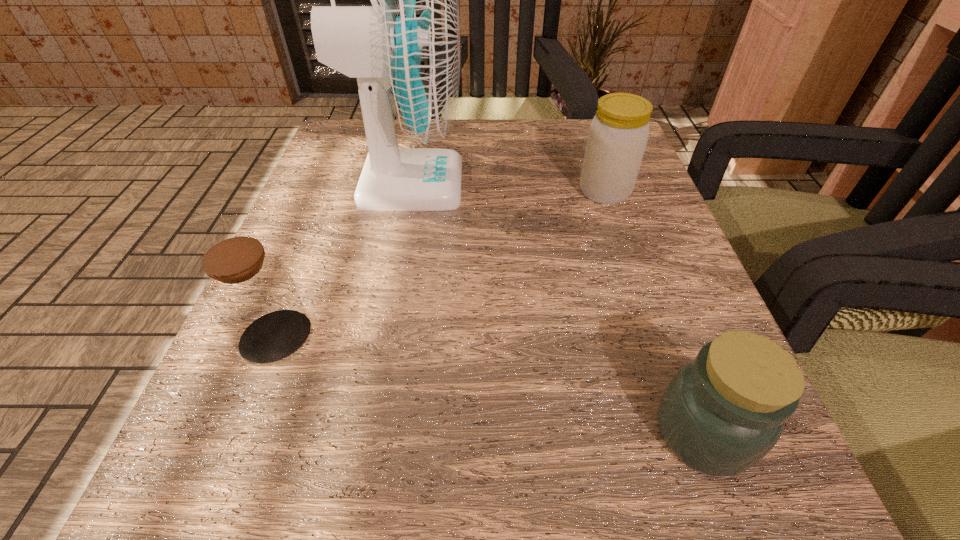
Locate an element on the screen. vacant space that's between the third farthest object and the nearest object is located at coordinates (490, 384).

Image resolution: width=960 pixels, height=540 pixels. I want to click on empty location between the leftmost jar and the nearest object, so (490, 384).

You are a GUI agent. You are given a task and a screenshot of the screen. Output one action in this format:
    pyautogui.click(x=<x>, y=<y>)
    Task: Click on the unoccupied area between the second farthest jar and the nearest object
    This screenshot has height=540, width=960.
    Given the screenshot: What is the action you would take?
    pyautogui.click(x=490, y=384)

The width and height of the screenshot is (960, 540). What are the coordinates of `vacant point located between the farthest jar and the leftmost jar` in the screenshot? It's located at (441, 264).

At what (x,y) coordinates should I click in order to perform the action: click on object that stands as the third closest to the farthest jar. Please return your answer as a coordinate pair (x, y). The height and width of the screenshot is (540, 960). Looking at the image, I should click on (251, 293).

You are a GUI agent. You are given a task and a screenshot of the screen. Output one action in this format:
    pyautogui.click(x=<x>, y=<y>)
    Task: Click on the second closest object to the nearest jar
    The image size is (960, 540).
    Given the screenshot: What is the action you would take?
    pyautogui.click(x=618, y=134)

Locate an element on the screen. The width and height of the screenshot is (960, 540). the closest jar to the fan is located at coordinates (251, 293).

Find the location of `the closest jar to the fan`. the closest jar to the fan is located at coordinates (251, 293).

The width and height of the screenshot is (960, 540). In order to click on free space that satisfies the following two spatial constraints: 1. in front of the fan to face the airflow; 2. on the right side of the nearest jar in this screenshot , I will do `click(360, 433)`.

Where is `free location that satisfies the following two spatial constraints: 1. on the front side of the farthest jar; 2. on the right side of the nearest object`? free location that satisfies the following two spatial constraints: 1. on the front side of the farthest jar; 2. on the right side of the nearest object is located at coordinates (685, 433).